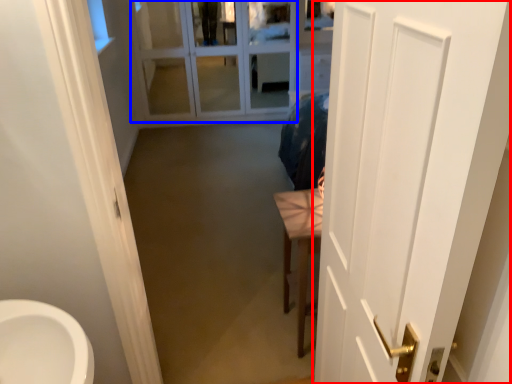
Question: Which object appears farthest to the camera in this image, door (highlighted by a red box) or glass door (highlighted by a blue box)?

Choices:
 (A) door
 (B) glass door

Answer: (B)